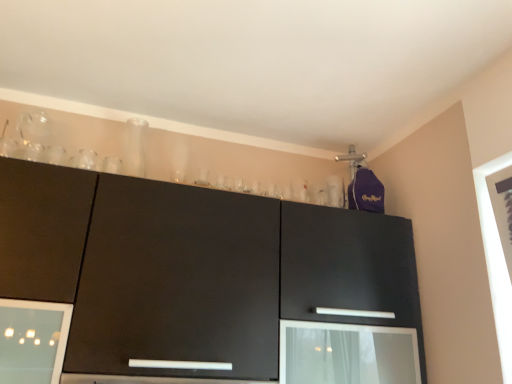
This screenshot has width=512, height=384. Identify the location of vacant space situated above transparent glass screen door at lower center (from a real-world perspective). (349, 322).